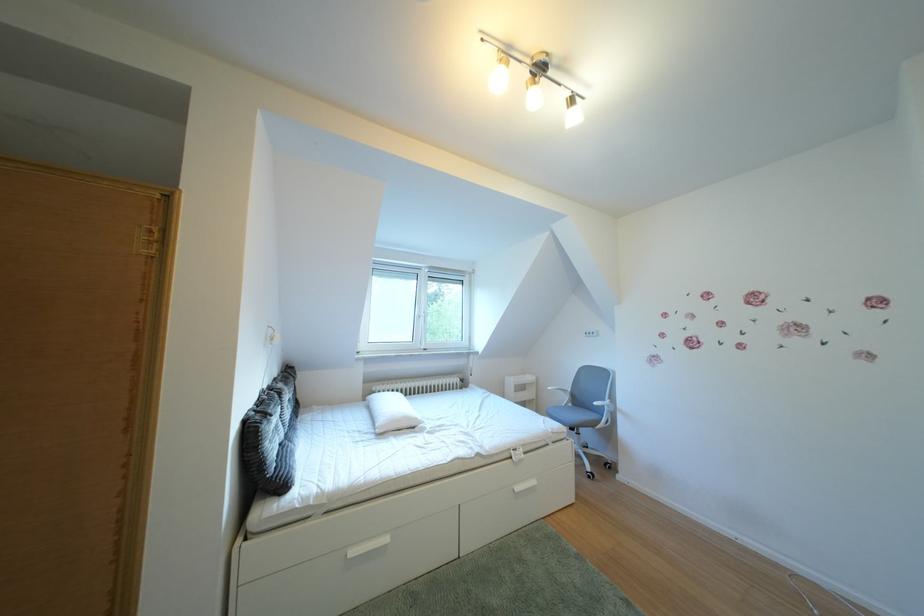
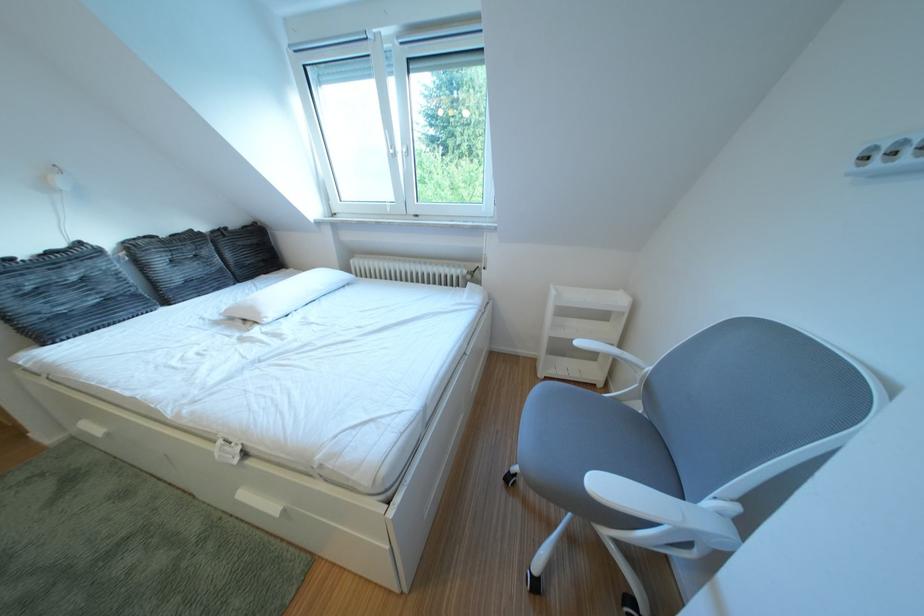
In the second image, find the point that corresponds to (x=430, y=424) in the first image.

(273, 318)